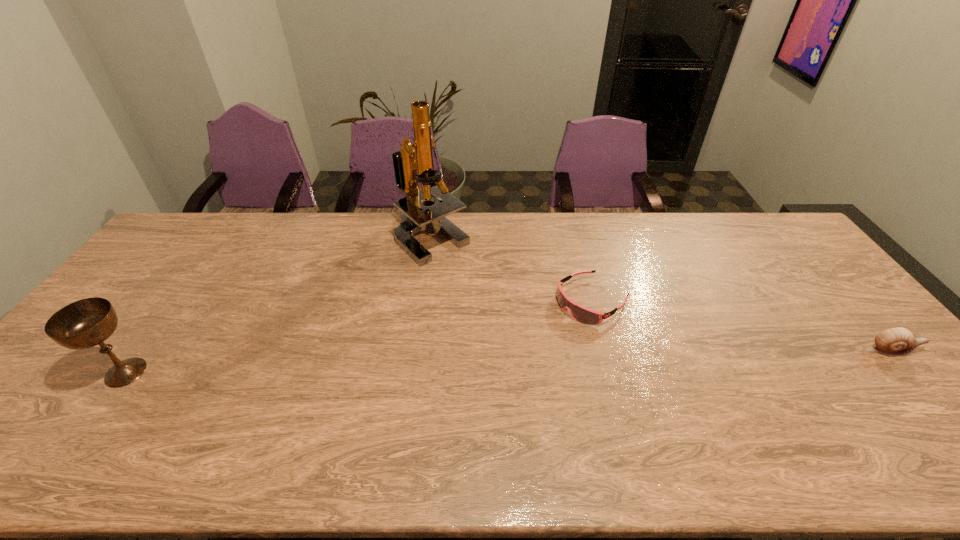
Identify the location of chalice. tap(85, 323).

The width and height of the screenshot is (960, 540). Identify the location of the leftmost object. (85, 323).

Where is `the rightmost object`? The width and height of the screenshot is (960, 540). the rightmost object is located at coordinates pyautogui.click(x=898, y=341).

The image size is (960, 540). I want to click on the second shortest object, so click(x=898, y=341).

Find the location of a particular element. Image resolution: width=960 pixels, height=540 pixels. goggles is located at coordinates (581, 314).

The image size is (960, 540). Identify the location of the second object from right to left. (581, 314).

You are a GUI agent. You are given a task and a screenshot of the screen. Output one action in this format:
    pyautogui.click(x=<x>, y=<y>)
    Task: Click on the second object from left to right
    This screenshot has width=960, height=540.
    Given the screenshot: What is the action you would take?
    pyautogui.click(x=411, y=158)

You are a GUI agent. You are given a task and a screenshot of the screen. Output one action in this format:
    pyautogui.click(x=<x>, y=<y>)
    Task: Click on the microscope
    
    Given the screenshot: What is the action you would take?
    pyautogui.click(x=411, y=158)

Locate an element on the screen. The width and height of the screenshot is (960, 540). free region located on the back of the third shortest object is located at coordinates (156, 330).

Locate an element on the screen. This screenshot has width=960, height=540. vacant region located on the front-facing side of the shortest object is located at coordinates (455, 387).